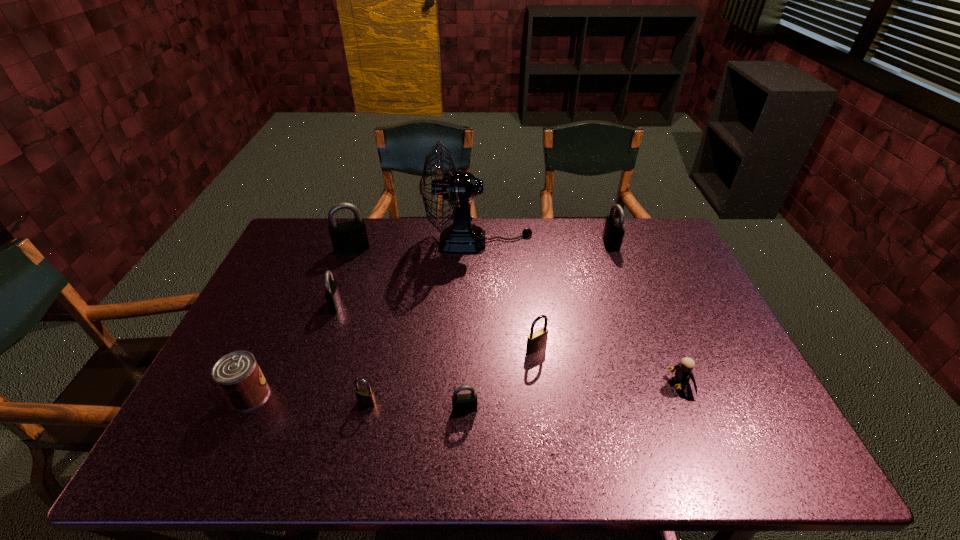
Image resolution: width=960 pixels, height=540 pixels. In the image, there is a desktop. What are the coordinates of `free space at the far edge` in the screenshot? It's located at (424, 218).

The width and height of the screenshot is (960, 540). I want to click on free space at the near edge of the desktop, so click(x=351, y=458).

Find the location of a particular element. vacant space at the right edge of the desktop is located at coordinates (654, 287).

This screenshot has width=960, height=540. I want to click on vacant space at the far left corner of the desktop, so click(298, 222).

In the image, there is a desktop. At what (x,y) coordinates should I click in order to perform the action: click on vacant space at the near left corner. Please return your answer as a coordinate pair (x, y). The height and width of the screenshot is (540, 960). Looking at the image, I should click on coord(238,464).

Image resolution: width=960 pixels, height=540 pixels. Find the location of `unoccupied position between the black fan and the right brass padlock`. unoccupied position between the black fan and the right brass padlock is located at coordinates (508, 295).

In order to click on free space between the black fan and the fourth padlock from left to right in this screenshot , I will do `click(472, 326)`.

You are a GUI agent. You are given a task and a screenshot of the screen. Output one action in this format:
    pyautogui.click(x=<x>, y=<y>)
    Task: Click on the blank region between the third farthest padlock and the Lego
    
    Given the screenshot: What is the action you would take?
    pyautogui.click(x=508, y=345)

Where is `empty space between the rightmost padlock and the bigger brass padlock`? The width and height of the screenshot is (960, 540). empty space between the rightmost padlock and the bigger brass padlock is located at coordinates (573, 296).

Find the location of `vacant area that lies between the black fan and the second nearest black padlock`. vacant area that lies between the black fan and the second nearest black padlock is located at coordinates (407, 273).